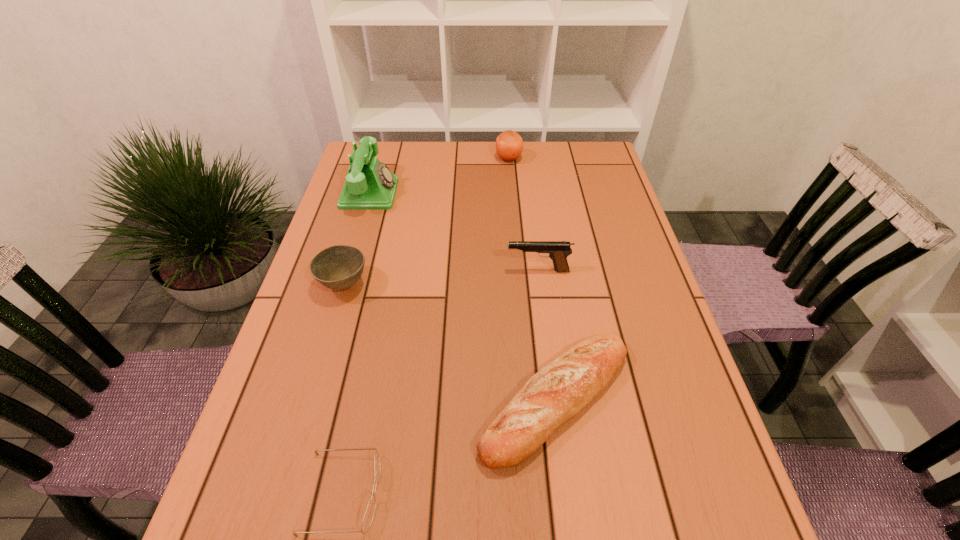
Locate an element on the screen. The width and height of the screenshot is (960, 540). vacant space situated at the muzzle of the pistol is located at coordinates (430, 271).

Identify the location of vacant space located at the muzzle of the pistol. (422, 271).

The image size is (960, 540). Find the location of `vacant space located 0.370m on the right of the bowl`. vacant space located 0.370m on the right of the bowl is located at coordinates (523, 286).

Locate an element on the screen. free region located 0.110m on the left of the baguet is located at coordinates (420, 400).

At what (x,y) coordinates should I click in order to perform the action: click on vacant space located on the front-facing side of the shortest object. Please return your answer as a coordinate pair (x, y). The height and width of the screenshot is (540, 960). Looking at the image, I should click on (x=546, y=493).

Locate an element on the screen. telephone that is at the far edge is located at coordinates (370, 185).

This screenshot has height=540, width=960. In order to click on orange at the far edge in this screenshot , I will do `click(509, 145)`.

At what (x,y) coordinates should I click in order to perform the action: click on object at the near edge. Please return your answer as a coordinate pair (x, y). This screenshot has width=960, height=540. Looking at the image, I should click on (369, 514).

Locate an element on the screen. telephone that is at the left edge is located at coordinates (370, 185).

Where is `bowl that is positioned at the left edge`? Image resolution: width=960 pixels, height=540 pixels. bowl that is positioned at the left edge is located at coordinates (339, 267).